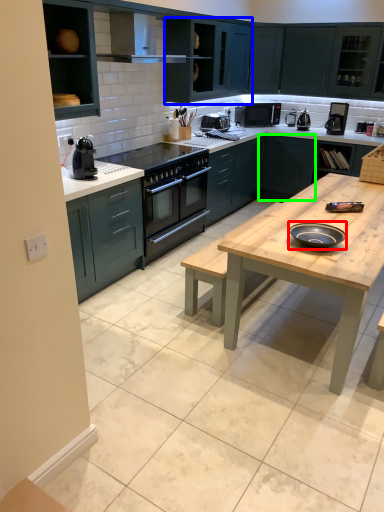
Question: Estimate the real-world distances between objects in this image. Which object is farther from pizza pan (highlighted by a red box), cabinetry (highlighted by a blue box) or cabinetry (highlighted by a green box)?

Choices:
 (A) cabinetry
 (B) cabinetry

Answer: (A)